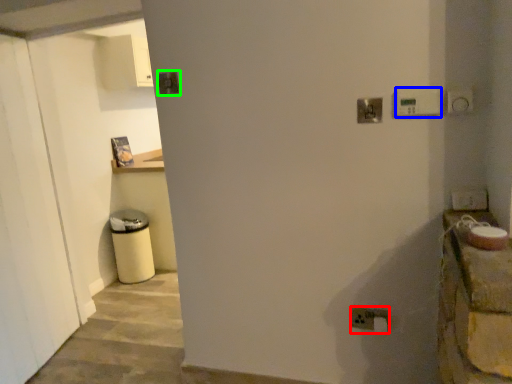
Question: Estimate the real-world distances between objects in this image. Which object is farther from electric outlet (highlighted by a red box), light switch (highlighted by a blue box) or light switch (highlighted by a green box)?

Choices:
 (A) light switch
 (B) light switch

Answer: (B)